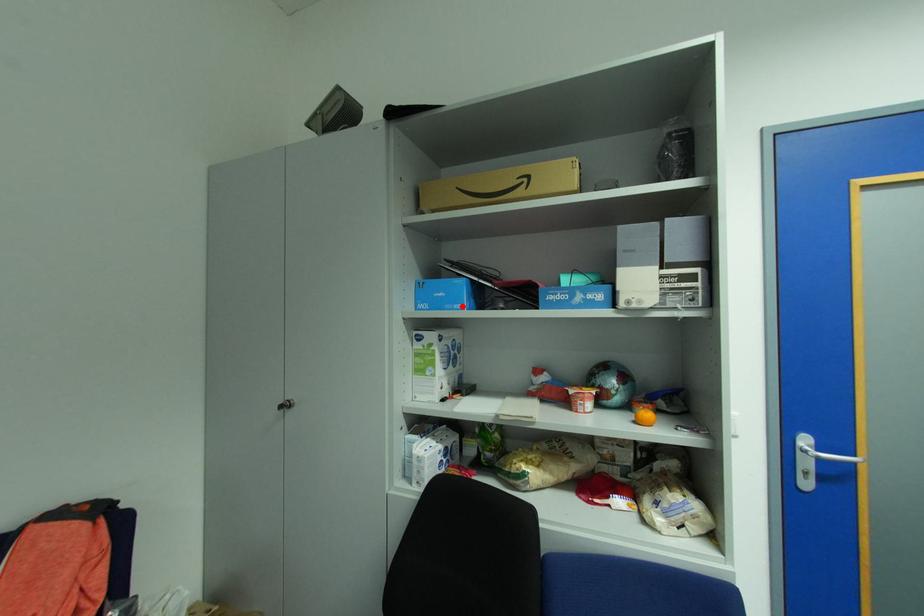
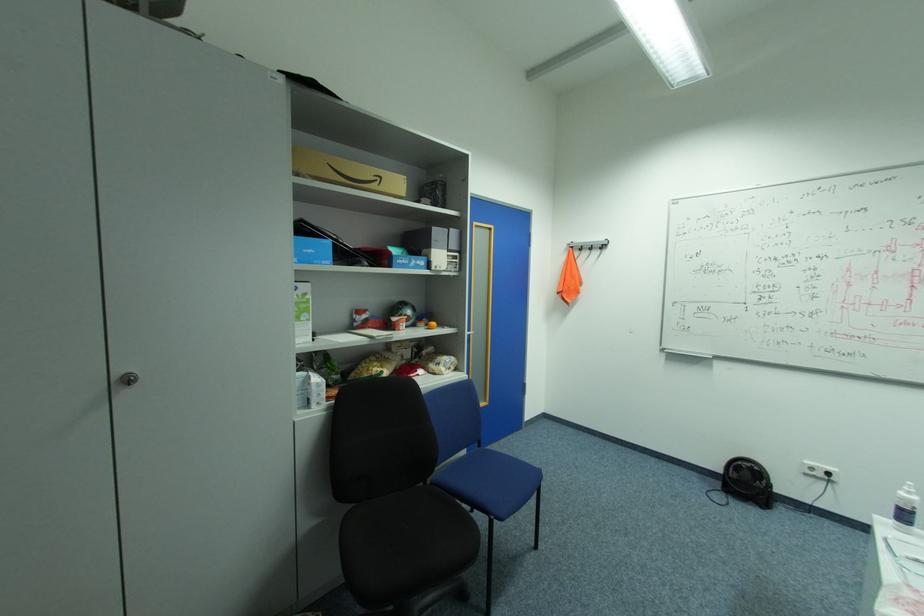
Locate, in the second image, the point that corresponds to the highlighted location in the first image.

(331, 262)